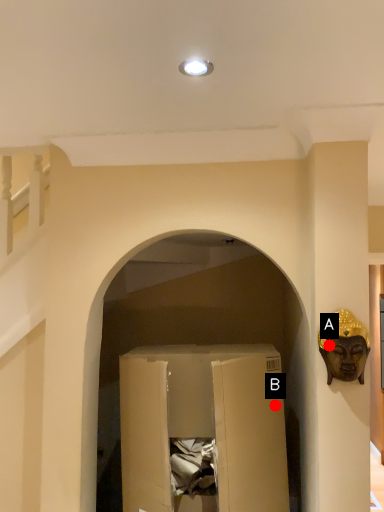
Question: Two points are circled on the image, labeled by A and B beside each circle. Which of the following is the farthest from the observer?

Choices:
 (A) A is further
 (B) B is further

Answer: (B)